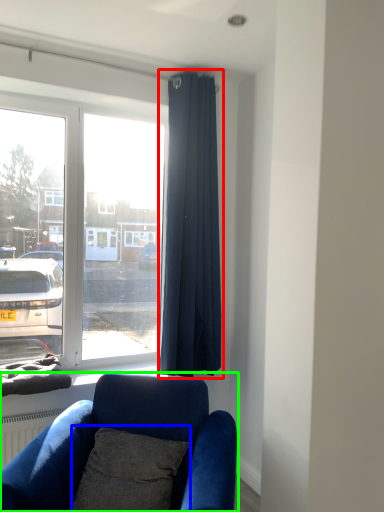
Question: Considering the real-world distances, which object is closest to curtain (highlighted by a red box)? pillow (highlighted by a blue box) or studio couch (highlighted by a green box).

Choices:
 (A) pillow
 (B) studio couch

Answer: (B)